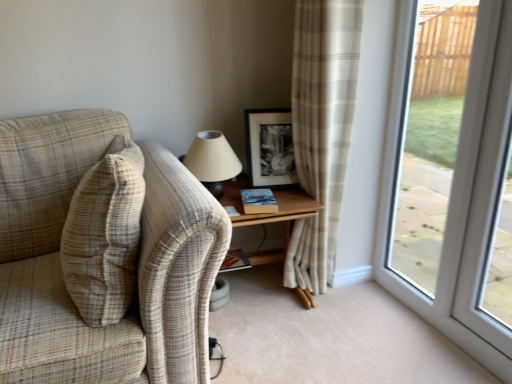
Find the location of a particular element. vacant space that is in between black matte picture frame at upper center and hardcover book at center, arranged as the second book when viewed from the back is located at coordinates (283, 195).